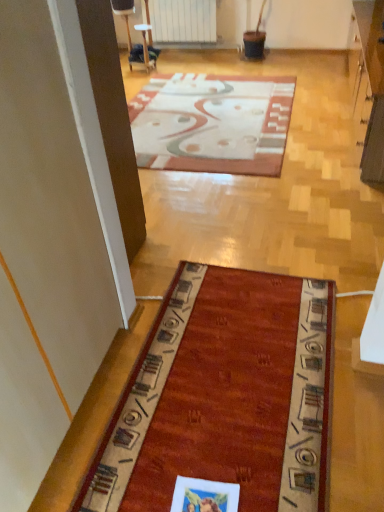
In order to face patterned carpet at center, should I rotate leftwards or rightwards?

To face it directly, rotate right by 1.676 degrees.

What do you see at coordinates (212, 123) in the screenshot? The width and height of the screenshot is (384, 512). I see `patterned carpet at center` at bounding box center [212, 123].

This screenshot has height=512, width=384. In order to click on patterned carpet at center in this screenshot , I will do `click(212, 123)`.

Image resolution: width=384 pixels, height=512 pixels. I want to click on white matte radiator at upper center, so click(x=183, y=21).

What do you see at coordinates (183, 21) in the screenshot?
I see `white matte radiator at upper center` at bounding box center [183, 21].

You are a GUI agent. You are given a task and a screenshot of the screen. Output one action in this format:
    pyautogui.click(x=<x>, y=<y>)
    Task: Click on the patterned carpet at center
    The height and width of the screenshot is (512, 384).
    Given the screenshot: What is the action you would take?
    pyautogui.click(x=212, y=123)

Does white matte radiator at upper center appear on the left side of patterned carpet at center?

Yes, white matte radiator at upper center is to the left of patterned carpet at center.

Is white matte radiator at upper center in front of patterned carpet at center?

No, the depth of white matte radiator at upper center is greater than that of patterned carpet at center.

Considering the positions of points (177, 26) and (181, 98), is point (177, 26) farther from camera compared to point (181, 98)?

Yes, point (177, 26) is farther from viewer.

From the image's perspective, is white matte radiator at upper center beneath patterned carpet at center?

No.

Consider the image. From a real-world perspective, is white matte radiator at upper center located higher than patterned carpet at center?

Yes, from a real-world perspective, white matte radiator at upper center is over patterned carpet at center

Between white matte radiator at upper center and patterned carpet at center, which one has larger width?

Wider between the two is patterned carpet at center.

Considering the relative sizes of white matte radiator at upper center and patterned carpet at center in the image provided, is white matte radiator at upper center shorter than patterned carpet at center?

In fact, white matte radiator at upper center may be taller than patterned carpet at center.

Considering the sizes of objects white matte radiator at upper center and patterned carpet at center in the image provided, who is smaller, white matte radiator at upper center or patterned carpet at center?

With smaller size is white matte radiator at upper center.

Is patterned carpet at center a part of white matte radiator at upper center?

That's incorrect, patterned carpet at center is not inside white matte radiator at upper center.

Does white matte radiator at upper center touch patterned carpet at center?

No, white matte radiator at upper center is not next to patterned carpet at center.

Is white matte radiator at upper center facing towards patterned carpet at center?

Yes, white matte radiator at upper center is oriented towards patterned carpet at center.

This screenshot has height=512, width=384. Find the location of `mat below the white matte radiator at upper center (from a real-world perspective)`. mat below the white matte radiator at upper center (from a real-world perspective) is located at coordinates (212, 123).

Which object is positioned more to the right, patterned carpet at center or white matte radiator at upper center?

Positioned to the right is patterned carpet at center.

Is patterned carpet at center closer to the viewer compared to white matte radiator at upper center?

Yes, patterned carpet at center is in front of white matte radiator at upper center.

Which is farther, (263, 130) or (154, 22)?

The point (154, 22) is farther from the camera.

Consider the image. From the image's perspective, which object appears higher, patterned carpet at center or white matte radiator at upper center?

From the image's view, white matte radiator at upper center is above.

From a real-world perspective, is patterned carpet at center physically located above or below white matte radiator at upper center?

patterned carpet at center is below white matte radiator at upper center.

Which of these two, patterned carpet at center or white matte radiator at upper center, is wider?

Wider between the two is patterned carpet at center.

Who is taller, patterned carpet at center or white matte radiator at upper center?

Standing taller between the two is white matte radiator at upper center.

Considering the relative sizes of patterned carpet at center and white matte radiator at upper center in the image provided, is patterned carpet at center smaller than white matte radiator at upper center?

No.

Choose the correct answer: Is patterned carpet at center inside white matte radiator at upper center or outside it?

patterned carpet at center lies outside white matte radiator at upper center.

Is patterned carpet at center far from white matte radiator at upper center?

Yes, patterned carpet at center is far from white matte radiator at upper center.

Is patterned carpet at center oriented away from white matte radiator at upper center?

No, patterned carpet at center is not facing away from white matte radiator at upper center.

What's the angular difference between patterned carpet at center and white matte radiator at upper center's facing directions?

There is a 89.4-degree angle between the facing directions of patterned carpet at center and white matte radiator at upper center.

Locate an element on the screen. This screenshot has width=384, height=512. radiator behind the patterned carpet at center is located at coordinates (183, 21).

I want to click on radiator behind the patterned carpet at center, so coord(183,21).

At what (x,y) coordinates should I click in order to perform the action: click on mat located in front of the white matte radiator at upper center. Please return your answer as a coordinate pair (x, y). This screenshot has width=384, height=512. Looking at the image, I should click on (212, 123).